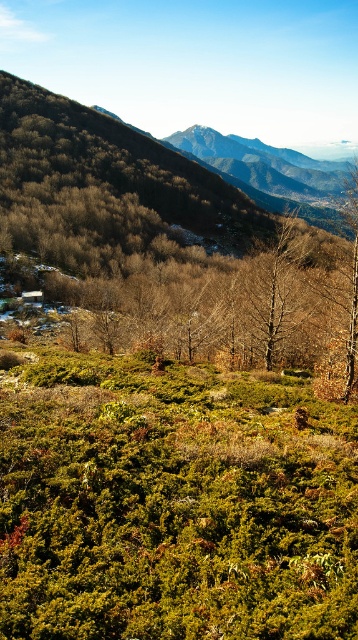
Based on the photo, you are an environmental scientist studying the spatial arrangement of trees in this mountainous landscape. You need to determine which tree is closer to your observation point. Which tree is nearer to you, the bare wood tree at center or the brown matte tree at upper right?

The bare wood tree at center is closer to you than the brown matte tree at upper right because it is positioned further to the viewer.